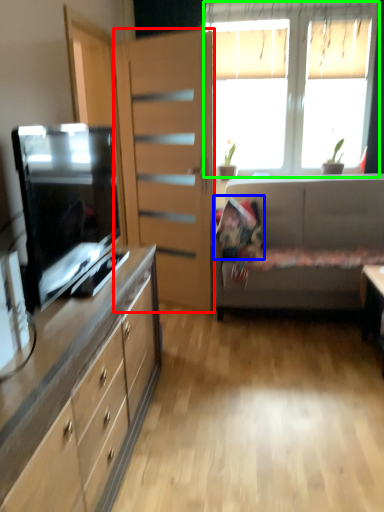
Question: Which object is the closest to the file cabinet (highlighted by a red box)? Choose among these: pillow (highlighted by a blue box) or window (highlighted by a green box).

Choices:
 (A) pillow
 (B) window

Answer: (A)